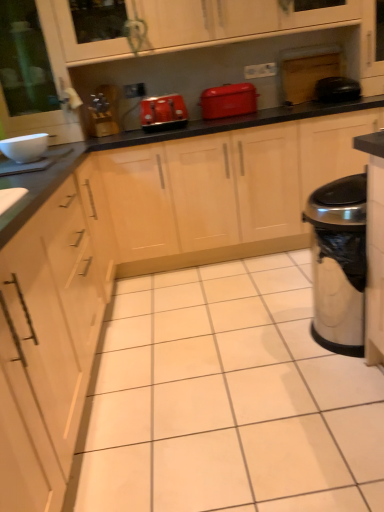
Question: From the image's perspective, is matte red toaster at center located above white glossy bowl at upper left, acting as the first appliance starting from the left?

Choices:
 (A) yes
 (B) no

Answer: (A)

Question: Does matte red toaster at center have a lesser height compared to white glossy bowl at upper left, which ranks as the second appliance in top-to-bottom order?

Choices:
 (A) yes
 (B) no

Answer: (B)

Question: Does matte red toaster at center come behind white glossy bowl at upper left, acting as the first appliance starting from the left?

Choices:
 (A) no
 (B) yes

Answer: (B)

Question: Are matte red toaster at center and white glossy bowl at upper left, which appears as the second appliance when viewed from the back, beside each other?

Choices:
 (A) no
 (B) yes

Answer: (A)

Question: Is matte red toaster at center positioned far away from white glossy bowl at upper left, acting as the first appliance starting from the left?

Choices:
 (A) no
 (B) yes

Answer: (B)

Question: Choose the correct answer: Is silver metallic trash can at right inside matte plastic toaster at center or outside it?

Choices:
 (A) inside
 (B) outside

Answer: (B)

Question: Considering their positions, is silver metallic trash can at right located in front of or behind matte plastic toaster at center?

Choices:
 (A) behind
 (B) front

Answer: (B)

Question: From a real-world perspective, is silver metallic trash can at right positioned above or below matte plastic toaster at center?

Choices:
 (A) below
 (B) above

Answer: (A)

Question: Based on their sizes in the image, would you say silver metallic trash can at right is bigger or smaller than matte plastic toaster at center?

Choices:
 (A) small
 (B) big

Answer: (B)

Question: Is black glossy countertop at center wider or thinner than matte red toaster at center?

Choices:
 (A) wide
 (B) thin

Answer: (A)

Question: In the image, is black glossy countertop at center positioned in front of or behind matte red toaster at center?

Choices:
 (A) front
 (B) behind

Answer: (A)

Question: From the image's perspective, is black glossy countertop at center above or below matte red toaster at center?

Choices:
 (A) below
 (B) above

Answer: (A)

Question: Considering the positions of point (34, 201) and point (243, 95), is point (34, 201) closer or farther from the camera than point (243, 95)?

Choices:
 (A) farther
 (B) closer

Answer: (B)

Question: Is matte wood cabinet at upper center bigger or smaller than black rubber trash can at right, positioned as the 2th appliance in left-to-right order?

Choices:
 (A) big
 (B) small

Answer: (A)

Question: From a real-world perspective, is matte wood cabinet at upper center above or below black rubber trash can at right, which appears as the first appliance when viewed from the back?

Choices:
 (A) below
 (B) above

Answer: (B)